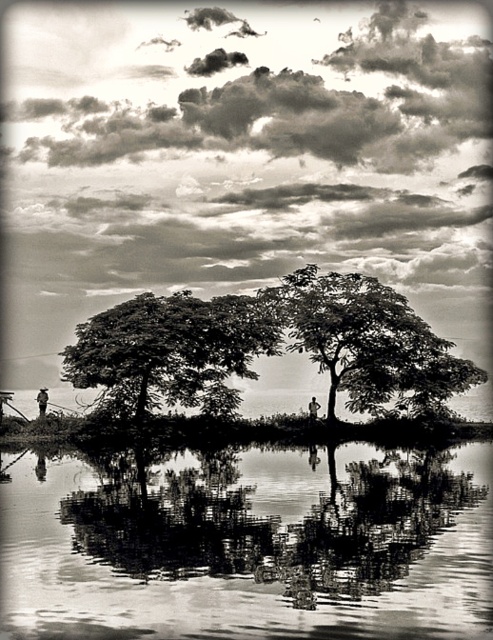
Question: Which point appears closest to the camera in this image?

Choices:
 (A) (287, 326)
 (B) (234, 460)
 (C) (212, 340)

Answer: (B)

Question: Can you confirm if dark green leafy tree at center is thinner than smooth bark tree at center?

Choices:
 (A) yes
 (B) no

Answer: (A)

Question: Is dark green leafy tree at center thinner than smooth bark tree at center?

Choices:
 (A) no
 (B) yes

Answer: (B)

Question: Is smooth reflective water at center closer to the viewer compared to smooth bark tree at center?

Choices:
 (A) no
 (B) yes

Answer: (B)

Question: Which object is closer to the camera taking this photo?

Choices:
 (A) smooth reflective water at center
 (B) dark green leafy tree at center
 (C) smooth bark tree at center

Answer: (A)

Question: Considering the real-world distances, which object is farthest from the dark green leafy tree at center?

Choices:
 (A) smooth reflective water at center
 (B) smooth bark tree at center

Answer: (A)